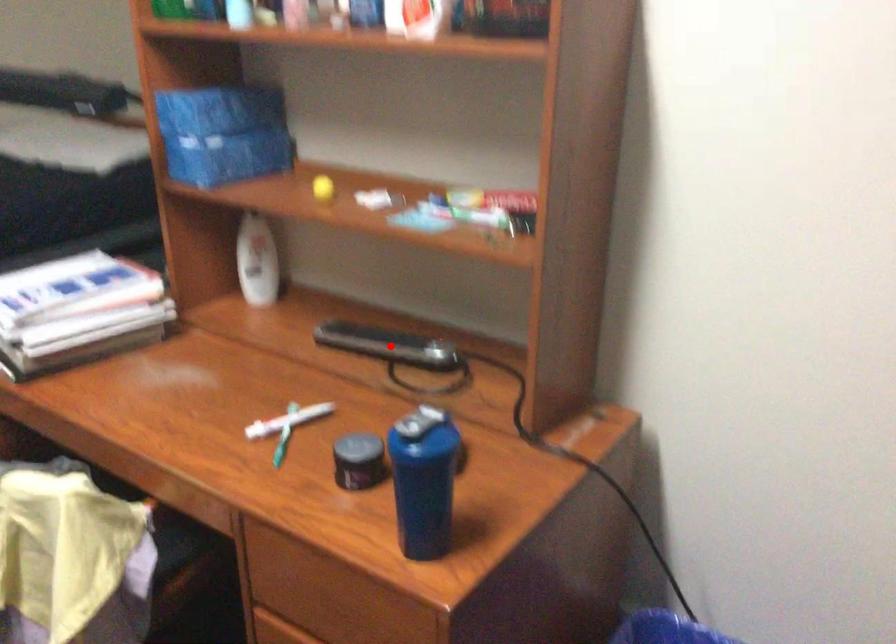
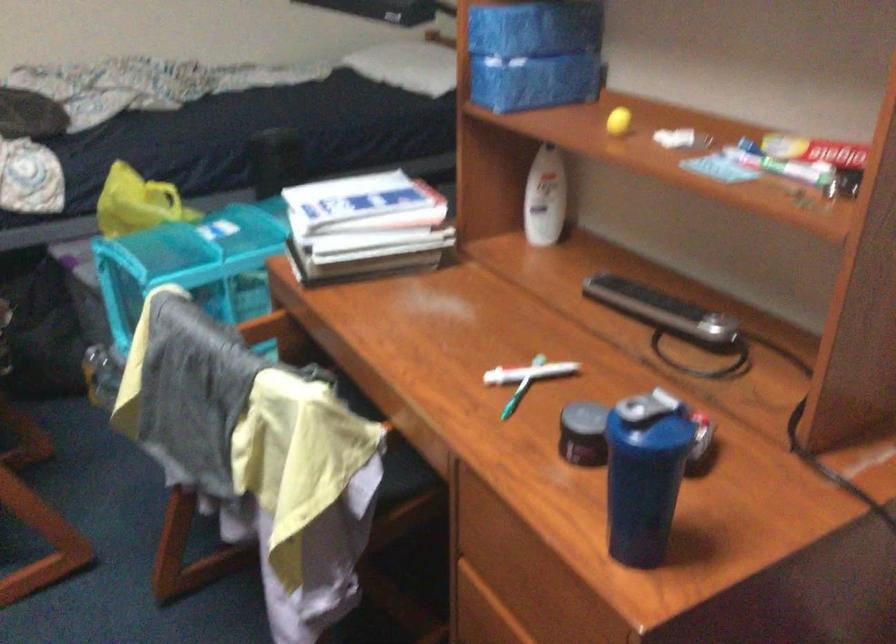
Where in the second image is the point corresponding to the highlighted location from the first image?

(661, 308)